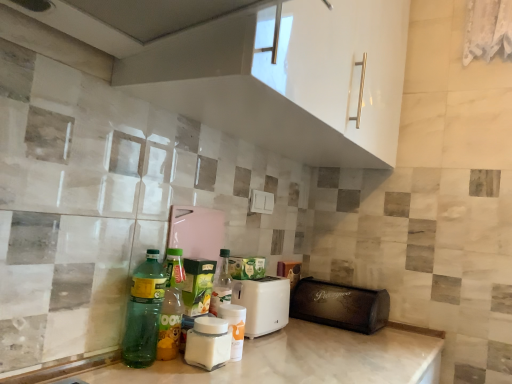
At what (x,y) coordinates should I click in order to perform the action: click on blank space situated above white plastic toaster at center, which ranks as the first appliance in left-to-right order (from a real-world perspective). Please return your answer as a coordinate pair (x, y). This screenshot has height=384, width=512. Looking at the image, I should click on (264, 276).